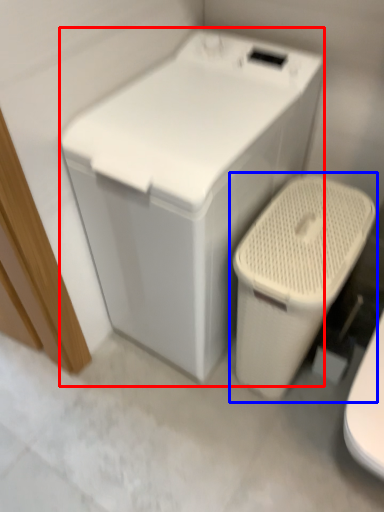
Question: Which of the following is the farthest to the observer, washing machine (highlighted by a red box) or toilet (highlighted by a blue box)?

Choices:
 (A) washing machine
 (B) toilet

Answer: (B)